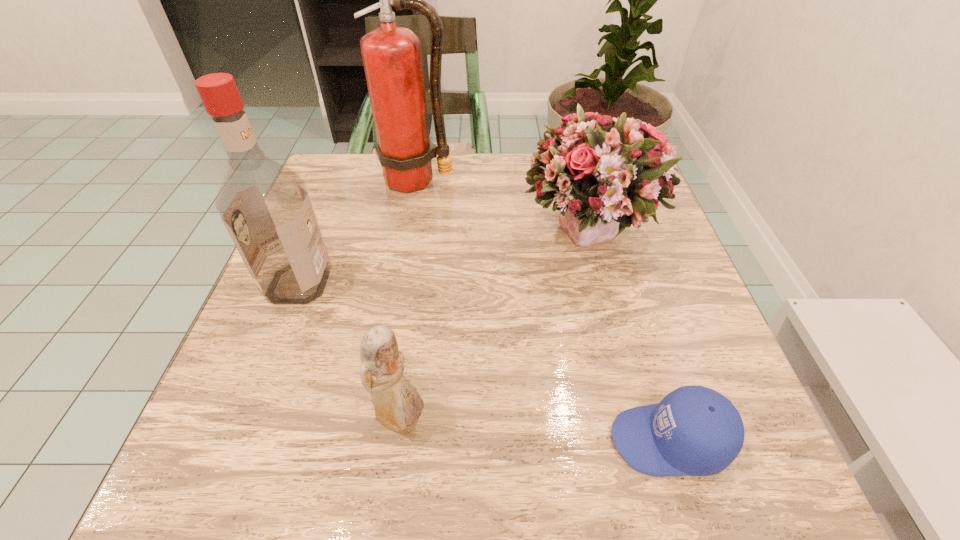
Find the location of `free space that is in between the fire extinguisher and the third tallest object`. free space that is in between the fire extinguisher and the third tallest object is located at coordinates (502, 207).

Locate an element on the screen. The width and height of the screenshot is (960, 540). vacant space that is in between the shortest object and the fire extinguisher is located at coordinates (543, 310).

What are the coordinates of `vacant region between the bouquet and the second shortest object` in the screenshot? It's located at (494, 328).

Image resolution: width=960 pixels, height=540 pixels. Identify the location of unoccupied position between the second shortest object and the third tallest object. (494, 328).

Where is `free space between the shortest object and the bouquet`? This screenshot has height=540, width=960. free space between the shortest object and the bouquet is located at coordinates (629, 338).

What are the coordinates of `vacant space that is in between the cap and the fire extinguisher` in the screenshot? It's located at click(x=543, y=310).

This screenshot has width=960, height=540. In order to click on free spot between the bouquet and the leftmost object in this screenshot , I will do `click(444, 259)`.

Identify the location of unoccupied position between the liquor and the fire extinguisher. The height and width of the screenshot is (540, 960). (358, 232).

Where is `object that is the third closest to the bouquet`? object that is the third closest to the bouquet is located at coordinates tap(398, 406).

Locate which object ranks in proximity to the fire extinguisher. Please provide its 2D coordinates. Your answer should be formatted as a tuple, i.e. [(x, y)], where the tuple contains the x and y coordinates of a point satisfying the conditions above.

[(604, 174)]